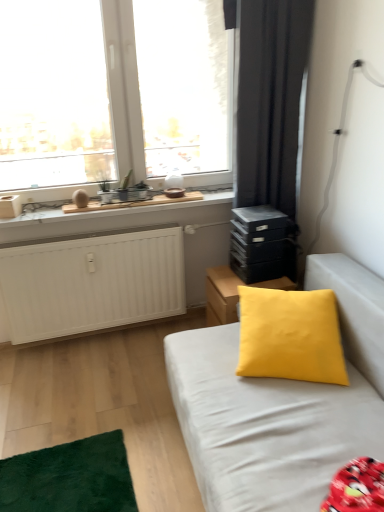
Question: In terms of height, does yellow fabric cushion at center look taller or shorter compared to yellow matte pillow at center?

Choices:
 (A) short
 (B) tall

Answer: (A)

Question: Looking at the image, does yellow fabric cushion at center seem bigger or smaller compared to yellow matte pillow at center?

Choices:
 (A) small
 (B) big

Answer: (A)

Question: Estimate the real-world distances between objects in this image. Which object is closer to the black matte stack of drawers at right?

Choices:
 (A) yellow matte pillow at center
 (B) black matte curtain at upper right
 (C) transparent glass window at upper left
 (D) yellow fabric cushion at center
 (E) matte yellow pillow at center

Answer: (D)

Question: Which of these objects is positioned closest to the yellow matte pillow at center?

Choices:
 (A) matte yellow pillow at center
 (B) transparent glass window at upper left
 (C) yellow fabric cushion at center
 (D) black matte stack of drawers at right
 (E) black matte curtain at upper right

Answer: (A)